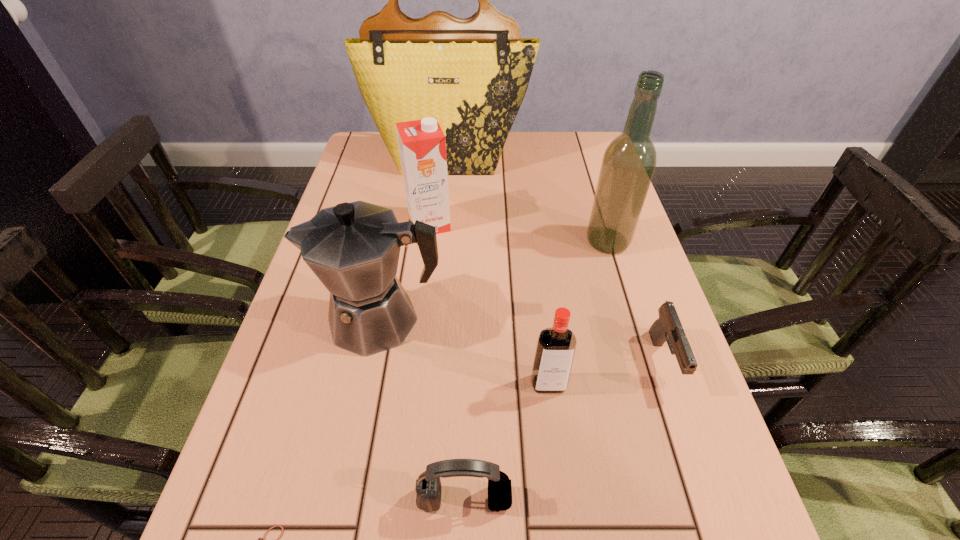
Image resolution: width=960 pixels, height=540 pixels. In order to click on free space located 0.200m on the front of the liquor in this screenshot , I will do `click(632, 321)`.

Image resolution: width=960 pixels, height=540 pixels. I want to click on blank space located on the front of the carton, so click(420, 294).

At what (x,y) coordinates should I click in order to perform the action: click on vacant space located 0.090m on the front and back of the vodka. Please return your answer as a coordinate pair (x, y). This screenshot has width=960, height=540. Looking at the image, I should click on (556, 443).

Find the location of a particular element. Image resolution: width=960 pixels, height=540 pixels. free space located 0.070m aim along the barrel of the pistol is located at coordinates (688, 433).

The image size is (960, 540). Find the location of `object present at the far edge`. object present at the far edge is located at coordinates (472, 74).

Find the location of a particular element. tote bag that is at the left edge is located at coordinates (472, 74).

This screenshot has width=960, height=540. Find the location of `coffeepot that is positioned at the left edge`. coffeepot that is positioned at the left edge is located at coordinates (353, 248).

You are a GUI agent. You are given a task and a screenshot of the screen. Output one action in this format:
    pyautogui.click(x=<x>, y=<y>)
    Task: Click on the liquor at the right edge
    
    Given the screenshot: What is the action you would take?
    pyautogui.click(x=628, y=164)

Locate an element on the screen. The width and height of the screenshot is (960, 540). pistol located in the right edge section of the desktop is located at coordinates (667, 328).

The width and height of the screenshot is (960, 540). What are the coordinates of `object at the far left corner` in the screenshot? It's located at (472, 74).